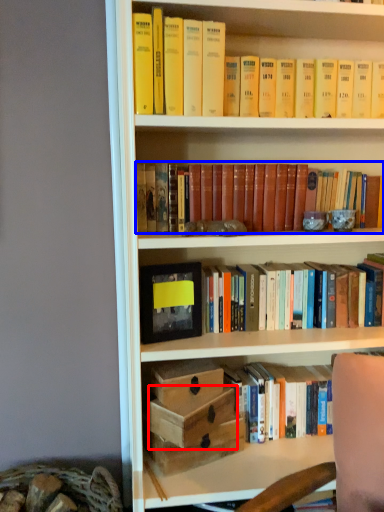
Question: Which object is closer to the camera taking this photo, box (highlighted by a red box) or book (highlighted by a blue box)?

Choices:
 (A) box
 (B) book

Answer: (A)